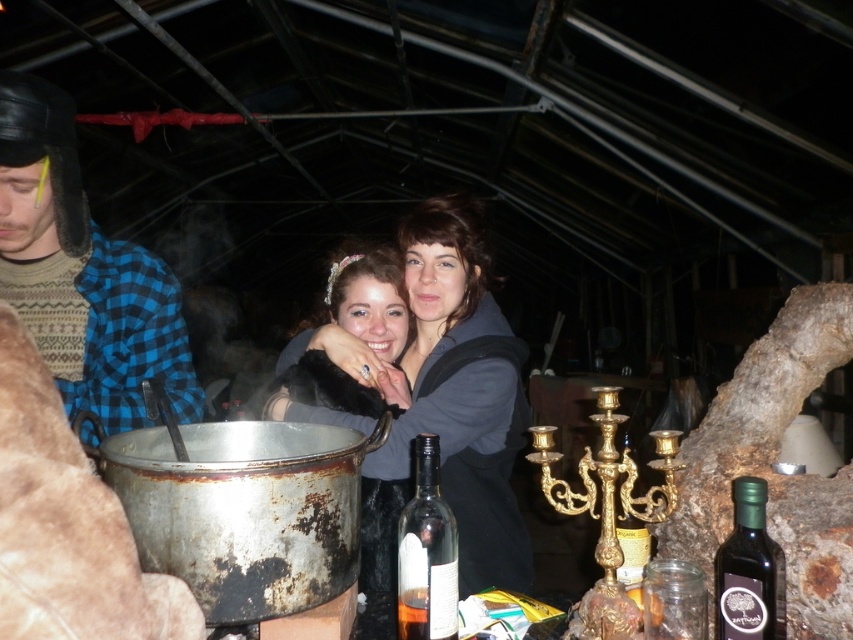
You are a guest at this event and want to grab the green glass bottle at right without moving the matte black fur coat at center. Is the bottle accessible from your current position?

The matte black fur coat at center is to the left of the green glass bottle at right, so the bottle is on the right side of the coat. Since you can reach around the coat, the green glass bottle at right is accessible without moving the matte black fur coat at center.

In the scene shown: You are organizing a small party and need to place a decorative item on a shelf. The shelf can only hold items that are smaller than the matte black fur coat at center. Do you think the green glass bottle at right will fit on the shelf?

The matte black fur coat at center is larger than the green glass bottle at right, so the green glass bottle at right will fit on the shelf since it is smaller than the coat.

You are a photographer setting up a camera to capture the scene. You need to ensure both the dark gray hoodie at center and the matte black fur coat at center are clearly visible in the frame. Given their sizes, which clothing item might require more careful framing to avoid being overshadowed?

The matte black fur coat at center is smaller in width compared to the dark gray hoodie at center, so it might require more careful framing to ensure it stands out and isn not overshadowed by the larger hoodie.